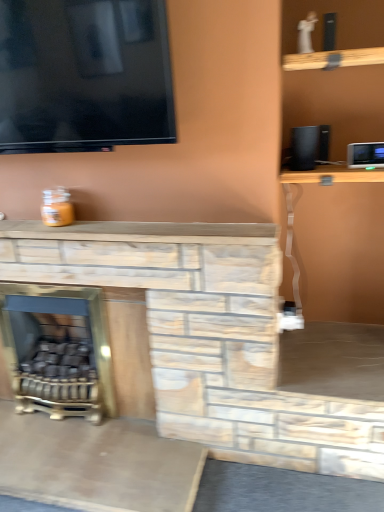
Question: Is black matte speaker at upper right facing towards white plastic appliance at upper right?

Choices:
 (A) yes
 (B) no

Answer: (B)

Question: Is white plastic appliance at upper right at the back of black matte speaker at upper right?

Choices:
 (A) no
 (B) yes

Answer: (A)

Question: Is white plastic appliance at upper right inside black matte speaker at upper right?

Choices:
 (A) yes
 (B) no

Answer: (B)

Question: Does black matte speaker at upper right have a greater width compared to white plastic appliance at upper right?

Choices:
 (A) no
 (B) yes

Answer: (B)

Question: Considering the relative positions of black matte speaker at upper right and white plastic appliance at upper right in the image provided, is black matte speaker at upper right in front of white plastic appliance at upper right?

Choices:
 (A) yes
 (B) no

Answer: (B)

Question: Is black matte speaker at upper right not close to white plastic appliance at upper right?

Choices:
 (A) no
 (B) yes

Answer: (A)

Question: Is black matte speaker at upper right taller than gold metallic fireplace at lower left?

Choices:
 (A) yes
 (B) no

Answer: (B)

Question: Is black matte speaker at upper right positioned before gold metallic fireplace at lower left?

Choices:
 (A) no
 (B) yes

Answer: (B)

Question: Is black matte speaker at upper right not inside gold metallic fireplace at lower left?

Choices:
 (A) no
 (B) yes

Answer: (B)

Question: Can you see black matte speaker at upper right touching gold metallic fireplace at lower left?

Choices:
 (A) yes
 (B) no

Answer: (B)

Question: Considering the relative sizes of black matte speaker at upper right and gold metallic fireplace at lower left in the image provided, is black matte speaker at upper right shorter than gold metallic fireplace at lower left?

Choices:
 (A) no
 (B) yes

Answer: (B)

Question: Can you confirm if black matte speaker at upper right is bigger than gold metallic fireplace at lower left?

Choices:
 (A) yes
 (B) no

Answer: (B)

Question: From the image's perspective, is gold metallic fireplace at lower left on top of white plastic appliance at upper right?

Choices:
 (A) yes
 (B) no

Answer: (B)